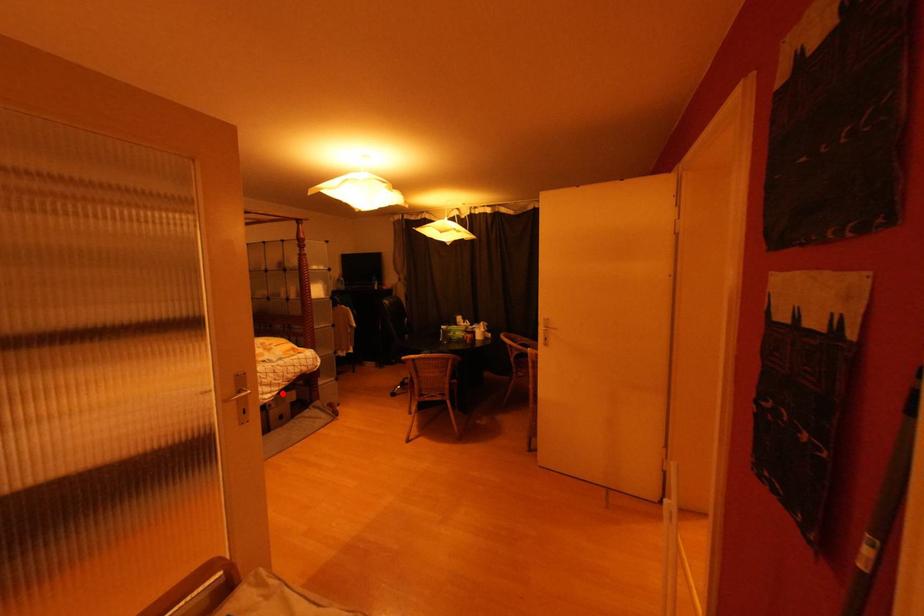
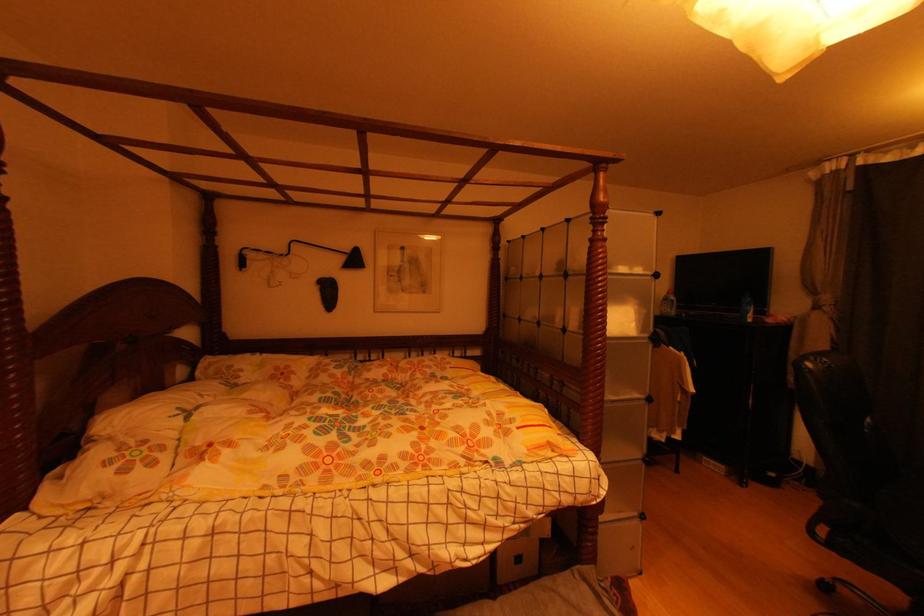
Question: I am providing you with two images of the same scene from different viewpoints. Given a red point in image1, look at the same physical point in image2. Is it:

Choices:
 (A) Closer to the viewpoint
 (B) Farther from the viewpoint

Answer: (B)